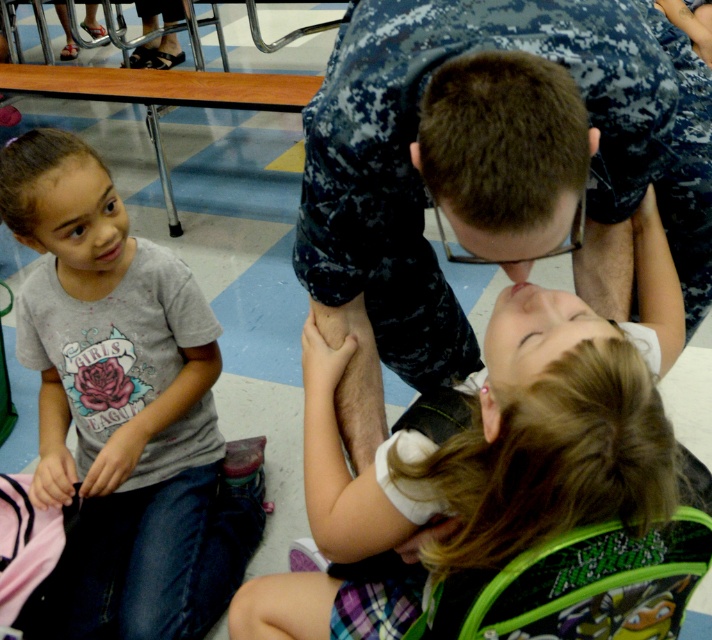
You are a photographer trying to capture a clear shot of both the camouflage uniform at center and the gray cotton shirt at lower left. Since you want both subjects in focus, which one should you focus on first to ensure depth of field?

You should focus on the camouflage uniform at center first because it is closer to the viewer than the gray cotton shirt at lower left, and depth of field typically requires focusing on the nearest subject for optimal clarity.

You are a tailor who needs to determine if the camouflage uniform at center can be altered to fit the gray cotton shirt at lower left. Based on their sizes, what would you advise?

The camouflage uniform at center is larger in size than the gray cotton shirt at lower left. Therefore, it can be altered to fit the gray cotton shirt at lower left as it has sufficient material.